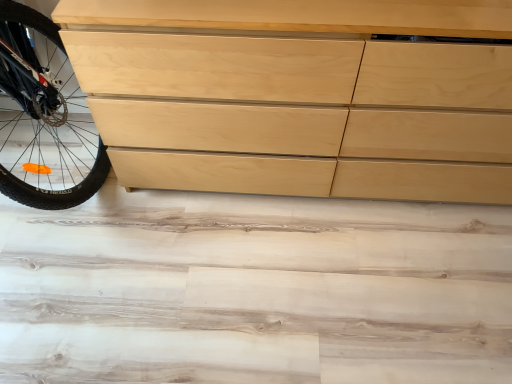
Question: Should I look upward or downward to see natural wood chest of drawers at left?

Choices:
 (A) up
 (B) down

Answer: (A)

Question: Is natural wood chest of drawers at left at the left side of wooden dresser at upper left?

Choices:
 (A) no
 (B) yes

Answer: (A)

Question: Is natural wood chest of drawers at left completely or partially outside of wooden dresser at upper left?

Choices:
 (A) yes
 (B) no

Answer: (A)

Question: Considering the relative sizes of natural wood chest of drawers at left and wooden dresser at upper left in the image provided, is natural wood chest of drawers at left wider than wooden dresser at upper left?

Choices:
 (A) no
 (B) yes

Answer: (A)

Question: Does natural wood chest of drawers at left have a greater height compared to wooden dresser at upper left?

Choices:
 (A) no
 (B) yes

Answer: (B)

Question: Can you confirm if natural wood chest of drawers at left is positioned to the right of wooden dresser at upper left?

Choices:
 (A) yes
 (B) no

Answer: (A)

Question: Can you confirm if natural wood chest of drawers at left is thinner than wooden dresser at upper left?

Choices:
 (A) yes
 (B) no

Answer: (A)

Question: From a real-world perspective, is wooden dresser at upper left on top of natural wood chest of drawers at left?

Choices:
 (A) yes
 (B) no

Answer: (B)

Question: Considering the relative positions of wooden dresser at upper left and natural wood chest of drawers at left in the image provided, is wooden dresser at upper left in front of natural wood chest of drawers at left?

Choices:
 (A) no
 (B) yes

Answer: (A)

Question: Does wooden dresser at upper left have a smaller size compared to natural wood chest of drawers at left?

Choices:
 (A) no
 (B) yes

Answer: (B)

Question: From the image's perspective, does wooden dresser at upper left appear lower than natural wood chest of drawers at left?

Choices:
 (A) no
 (B) yes

Answer: (B)

Question: Are wooden dresser at upper left and natural wood chest of drawers at left beside each other?

Choices:
 (A) yes
 (B) no

Answer: (B)

Question: Can you confirm if wooden dresser at upper left is wider than natural wood chest of drawers at left?

Choices:
 (A) yes
 (B) no

Answer: (A)

Question: Does point (445, 122) appear closer or farther from the camera than point (19, 258)?

Choices:
 (A) farther
 (B) closer

Answer: (B)